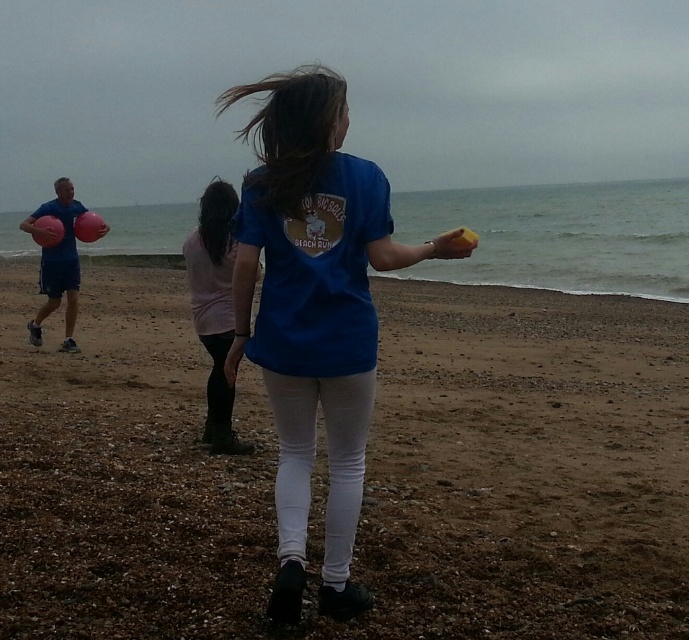
Can you confirm if brown sandy beach at center is thinner than blue matte t-shirt at center?

Incorrect, brown sandy beach at center's width is not less than blue matte t-shirt at center's.

Is point (152, 561) closer to camera compared to point (267, 362)?

No, it is behind (267, 362).

The image size is (689, 640). In order to click on brown sandy beach at center in this screenshot , I will do `click(364, 476)`.

Which of these two, brown sandy beach at center or pink fabric shirt at center, stands taller?

With more height is pink fabric shirt at center.

Is point (413, 493) positioned before point (209, 314)?

That is True.

From the picture: Measure the distance between brown sandy beach at center and camera.

brown sandy beach at center and camera are 3.10 meters apart from each other.

What are the coordinates of `brown sandy beach at center` in the screenshot? It's located at (364, 476).

Is point (285, 520) in front of point (209, 300)?

That is True.

Is blue matte t-shirt at center further to the viewer compared to pink fabric shirt at center?

No, it is in front of pink fabric shirt at center.

You are a GUI agent. You are given a task and a screenshot of the screen. Output one action in this format:
    pyautogui.click(x=<x>, y=<y>)
    Task: Click on the blue matte t-shirt at center
    The height and width of the screenshot is (640, 689).
    Given the screenshot: What is the action you would take?
    pyautogui.click(x=313, y=312)